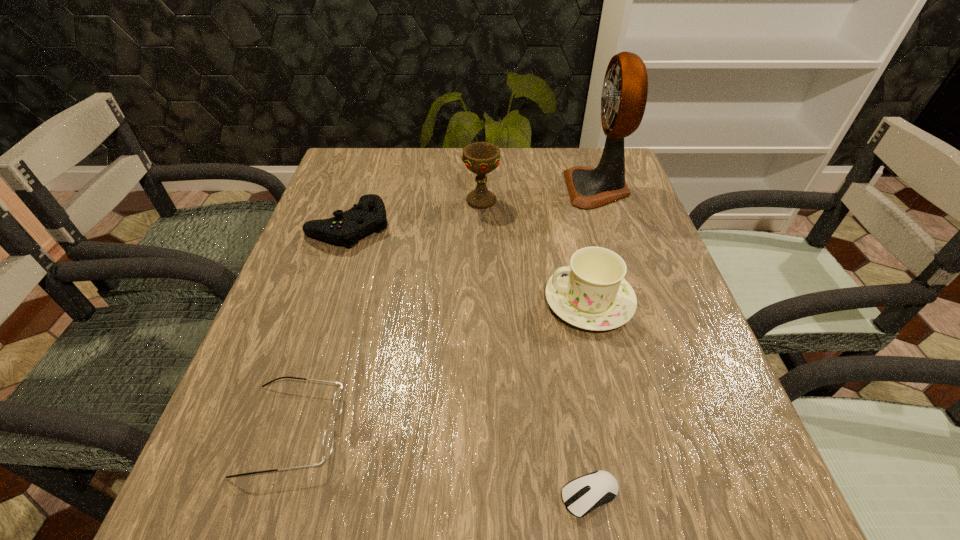
Image resolution: width=960 pixels, height=540 pixels. Find the location of `free space between the fan and the fourth shortest object`. free space between the fan and the fourth shortest object is located at coordinates (593, 245).

At what (x,y) coordinates should I click in order to perform the action: click on free space between the spectacles and the fourth object from right to left. Please return your answer as a coordinate pair (x, y). The height and width of the screenshot is (540, 960). Looking at the image, I should click on (387, 315).

Locate an element on the screen. This screenshot has width=960, height=540. vacant area that lies between the control and the spectacles is located at coordinates (321, 327).

Image resolution: width=960 pixels, height=540 pixels. In order to click on free space between the fourth tallest object and the third tallest object in this screenshot , I will do (x=469, y=263).

At what (x,y) coordinates should I click in order to perform the action: click on free space between the mouse and the fan. Please return your answer as a coordinate pair (x, y). This screenshot has width=960, height=540. Looking at the image, I should click on (593, 342).

Identify the location of object that ranks as the second closest to the third shortest object. (328, 439).

Locate which object ranks fifth in proximity to the tallest object. Please provide its 2D coordinates. Your answer should be formatted as a tuple, i.e. [(x, y)], where the tuple contains the x and y coordinates of a point satisfying the conditions above.

[(328, 439)]

Image resolution: width=960 pixels, height=540 pixels. In order to click on free region that satisfies the following two spatial constraints: 1. through the lenses of the fifth tallest object; 2. on the back side of the mouse in this screenshot , I will do `click(272, 495)`.

Locate an element on the screen. The image size is (960, 540). vacant space that satisfies the following two spatial constraints: 1. on the back side of the fourth tallest object; 2. on the right side of the chalice is located at coordinates (357, 201).

Identify the location of vacant position in the image that satisfies the following two spatial constraints: 1. through the lenses of the shortest object; 2. on the left side of the second shortest object. The image size is (960, 540). (272, 495).